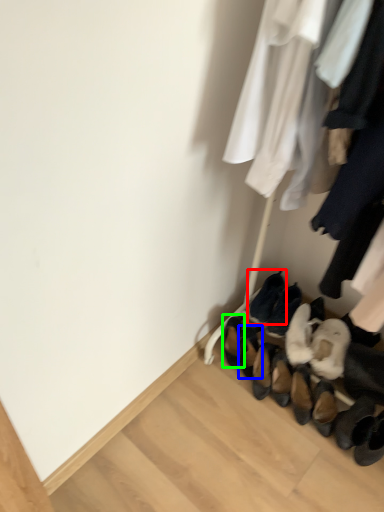
Question: Which is farther away from footwear (highlighted by a red box)? footwear (highlighted by a blue box) or footwear (highlighted by a green box)?

Choices:
 (A) footwear
 (B) footwear

Answer: (B)